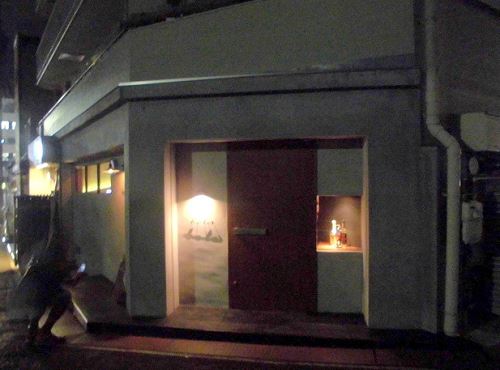
Locate an element on the screen. window is located at coordinates (102, 180), (83, 180), (4, 124).